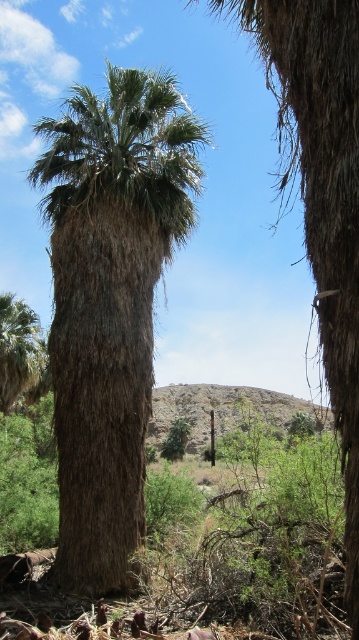
Question: Is brown textured palm tree at center wider than green leafy palm tree at lower left?

Choices:
 (A) no
 (B) yes

Answer: (B)

Question: Considering the relative positions of brown textured palm tree at center and green leafy palm tree at lower left in the image provided, where is brown textured palm tree at center located with respect to green leafy palm tree at lower left?

Choices:
 (A) below
 (B) above

Answer: (B)

Question: Which point appears farthest from the camera in this image?

Choices:
 (A) (106, 243)
 (B) (3, 308)

Answer: (B)

Question: Does brown textured palm tree at center have a smaller size compared to green leafy palm tree at lower left?

Choices:
 (A) no
 (B) yes

Answer: (A)

Question: Which of the following is the farthest from the observer?

Choices:
 (A) green leafy palm tree at lower left
 (B) brown textured palm tree at center

Answer: (A)

Question: Among these objects, which one is farthest from the camera?

Choices:
 (A) green leafy palm tree at lower left
 (B) brown textured palm tree at center

Answer: (A)